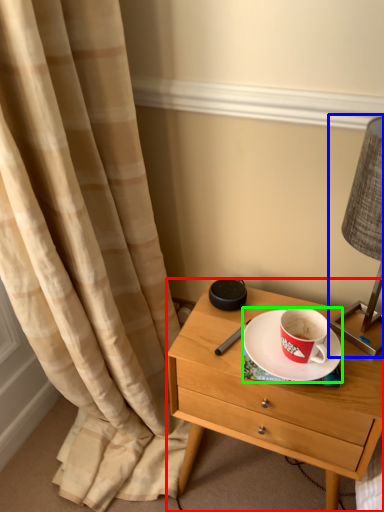
Question: Which is farther away from nightstand (highlighted by a red box)? bedside lamp (highlighted by a blue box) or saucer (highlighted by a green box)?

Choices:
 (A) bedside lamp
 (B) saucer

Answer: (A)